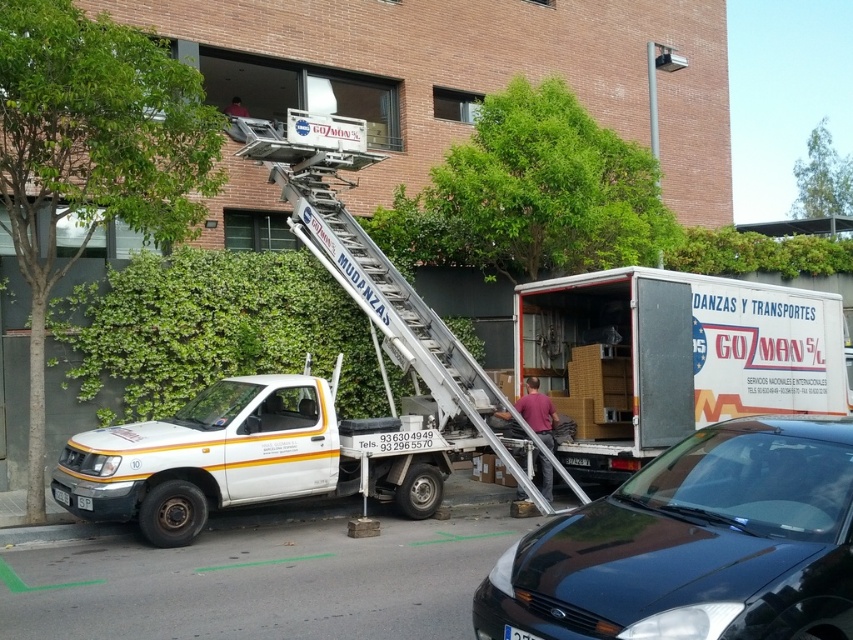
You are a pedestrian standing on the sidewalk in front of the brick building. You see a black matte car at center and a white matte truck at lower left. Which vehicle is closer to the building?

The white matte truck at lower left is closer to the building because the black matte car at center is to the right of it, meaning the truck is positioned between the building and the car.

You are a delivery person who needs to park your vehicle in front of the brick building. There is a black matte car at center and a white plastic license plate at center in the image. Which object should you avoid blocking when parking?

You should avoid blocking the white plastic license plate at center because the black matte car at center is to its right, meaning the license plate is positioned to the left of the car. Blocking the license plate could obstruct its visibility or access.

You are standing in front of the white truck with orange and yellow stripes, which has a ladder extended to the second floor of the brick building. There is a point at coordinates point (637, 618). Can you determine how far this point is from you in feet?

The point (637, 618) is 11.46 feet away from the viewer.